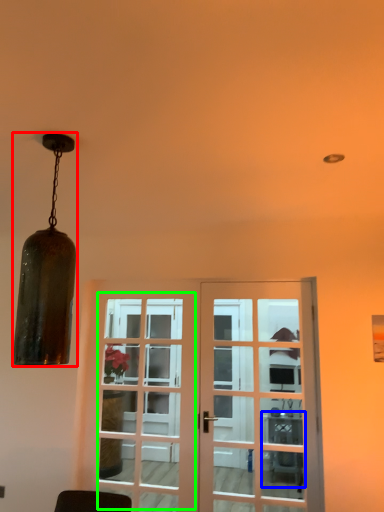
Question: Based on their relative distances, which object is farther from lamp (highlighted by a red box)? Choose from table (highlighted by a blue box) and screen door (highlighted by a green box).

Choices:
 (A) table
 (B) screen door

Answer: (A)